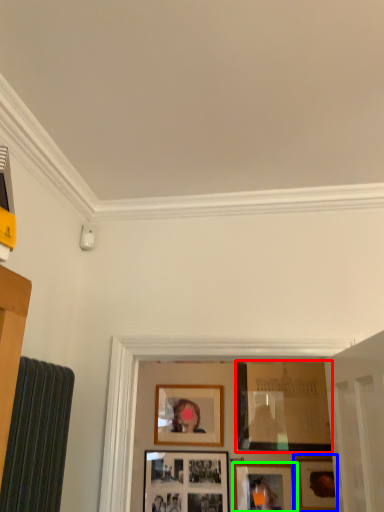
Question: Estimate the real-world distances between objects in this image. Which object is closer to picture frame (highlighted by a red box), picture frame (highlighted by a blue box) or picture frame (highlighted by a green box)?

Choices:
 (A) picture frame
 (B) picture frame

Answer: (A)